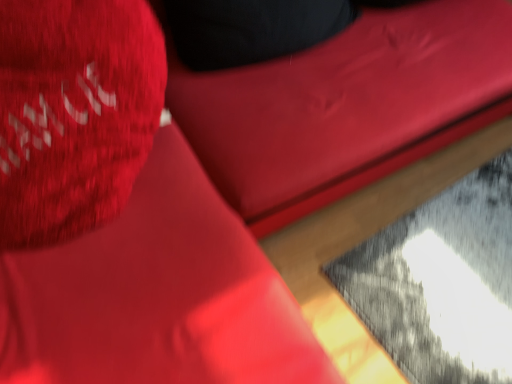
Find the location of `velvet-like red bean bag chair at upper center`. velvet-like red bean bag chair at upper center is located at coordinates (347, 106).

Describe the element at coordinates (347, 106) in the screenshot. Image resolution: width=512 pixels, height=384 pixels. I see `velvet-like red bean bag chair at upper center` at that location.

Describe the element at coordinates (74, 113) in the screenshot. I see `matte red throw pillow at upper left` at that location.

Measure the distance between point (x=161, y=104) and camera.

The distance of point (x=161, y=104) from camera is 38.94 inches.

Locate an element on the screen. matte red throw pillow at upper left is located at coordinates (74, 113).

The width and height of the screenshot is (512, 384). In order to click on velvet-like red bean bag chair at upper center in this screenshot , I will do `click(347, 106)`.

Does matte red throw pillow at upper left appear on the right side of velvet-like red bean bag chair at upper center?

No, matte red throw pillow at upper left is not to the right of velvet-like red bean bag chair at upper center.

Is matte red throw pillow at upper left in front of velvet-like red bean bag chair at upper center?

That is True.

Considering the positions of points (6, 95) and (375, 136), is point (6, 95) closer to camera compared to point (375, 136)?

Yes, point (6, 95) is in front of point (375, 136).

From the image's perspective, is matte red throw pillow at upper left over velvet-like red bean bag chair at upper center?

No, from the image's perspective, matte red throw pillow at upper left is not on top of velvet-like red bean bag chair at upper center.

From a real-world perspective, is matte red throw pillow at upper left positioned under velvet-like red bean bag chair at upper center based on gravity?

No.

Is matte red throw pillow at upper left wider than velvet-like red bean bag chair at upper center?

No.

Between matte red throw pillow at upper left and velvet-like red bean bag chair at upper center, which one has less height?

With less height is matte red throw pillow at upper left.

Can you confirm if matte red throw pillow at upper left is smaller than velvet-like red bean bag chair at upper center?

Yes, matte red throw pillow at upper left is smaller than velvet-like red bean bag chair at upper center.

Which is correct: matte red throw pillow at upper left is inside velvet-like red bean bag chair at upper center, or outside of it?

matte red throw pillow at upper left exists outside the volume of velvet-like red bean bag chair at upper center.

Is matte red throw pillow at upper left beside velvet-like red bean bag chair at upper center?

matte red throw pillow at upper left is not next to velvet-like red bean bag chair at upper center, and they're not touching.

Is matte red throw pillow at upper left oriented away from velvet-like red bean bag chair at upper center?

No, matte red throw pillow at upper left's orientation is not away from velvet-like red bean bag chair at upper center.

Can you tell me how much matte red throw pillow at upper left and velvet-like red bean bag chair at upper center differ in facing direction?

The facing directions of matte red throw pillow at upper left and velvet-like red bean bag chair at upper center are 0.000223 degrees apart.

Where is `throw pillow that appears on the left of velvet-like red bean bag chair at upper center`? The image size is (512, 384). throw pillow that appears on the left of velvet-like red bean bag chair at upper center is located at coordinates (74, 113).

Would you say velvet-like red bean bag chair at upper center is to the left or to the right of matte red throw pillow at upper left in the picture?

From the image, it's evident that velvet-like red bean bag chair at upper center is to the right of matte red throw pillow at upper left.

Considering the positions of objects velvet-like red bean bag chair at upper center and matte red throw pillow at upper left in the image provided, who is behind, velvet-like red bean bag chair at upper center or matte red throw pillow at upper left?

velvet-like red bean bag chair at upper center is more distant.

Considering the positions of points (320, 137) and (12, 132), is point (320, 137) closer to camera compared to point (12, 132)?

No, it is not.

From the image's perspective, is velvet-like red bean bag chair at upper center below matte red throw pillow at upper left?

Incorrect, from the image's perspective, velvet-like red bean bag chair at upper center is higher than matte red throw pillow at upper left.

From a real-world perspective, is velvet-like red bean bag chair at upper center physically above matte red throw pillow at upper left?

No.

Can you confirm if velvet-like red bean bag chair at upper center is wider than matte red throw pillow at upper left?

Correct, the width of velvet-like red bean bag chair at upper center exceeds that of matte red throw pillow at upper left.

Is velvet-like red bean bag chair at upper center taller than matte red throw pillow at upper left?

Yes.

Does velvet-like red bean bag chair at upper center have a smaller size compared to matte red throw pillow at upper left?

No.

Does velvet-like red bean bag chair at upper center contain matte red throw pillow at upper left?

No.

Are velvet-like red bean bag chair at upper center and matte red throw pillow at upper left beside each other?

No, velvet-like red bean bag chair at upper center is not touching matte red throw pillow at upper left.

Could you tell me if velvet-like red bean bag chair at upper center is facing matte red throw pillow at upper left?

No, velvet-like red bean bag chair at upper center is not aimed at matte red throw pillow at upper left.

Locate an element on the screen. Image resolution: width=512 pixels, height=384 pixels. throw pillow below the velvet-like red bean bag chair at upper center (from the image's perspective) is located at coordinates (74, 113).

Where is `bean bag chair above the matte red throw pillow at upper left (from the image's perspective)`? bean bag chair above the matte red throw pillow at upper left (from the image's perspective) is located at coordinates (347, 106).

Identify the location of throw pillow located below the velvet-like red bean bag chair at upper center (from the image's perspective). This screenshot has height=384, width=512. (74, 113).